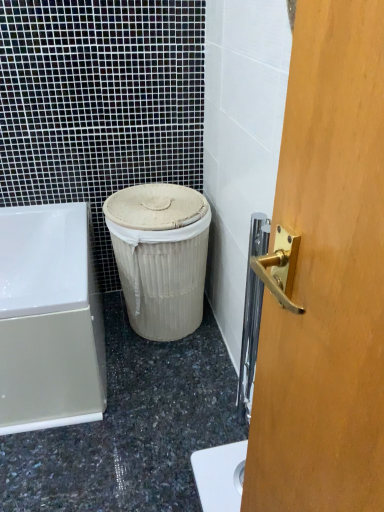
What do you see at coordinates (160, 256) in the screenshot? This screenshot has height=512, width=384. I see `beige woven basket at center` at bounding box center [160, 256].

Measure the distance between point (156, 243) and camera.

They are 5.12 feet apart.

In order to click on beige woven basket at center in this screenshot , I will do `click(160, 256)`.

Locate an element on the screen. beige woven basket at center is located at coordinates (160, 256).